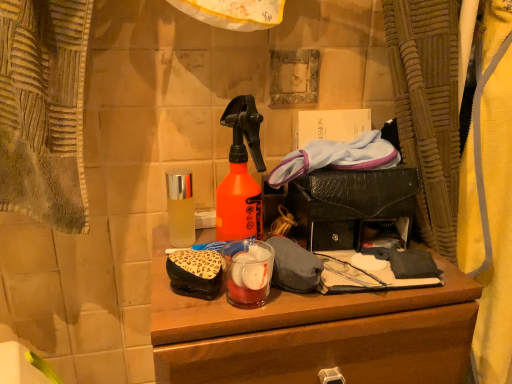
Question: Considering their positions, is wooden desk at center located in front of or behind clear glass bottle at center?

Choices:
 (A) front
 (B) behind

Answer: (A)

Question: From a real-world perspective, is wooden desk at center physically located above or below clear glass bottle at center?

Choices:
 (A) below
 (B) above

Answer: (A)

Question: Which object is positioned closest to the leopard print fabric pouch at center?

Choices:
 (A) wooden desk at center
 (B) clear glass bottle at center

Answer: (B)

Question: Which of these objects is positioned closest to the leopard print fabric pouch at center?

Choices:
 (A) clear glass bottle at center
 (B) wooden desk at center

Answer: (A)